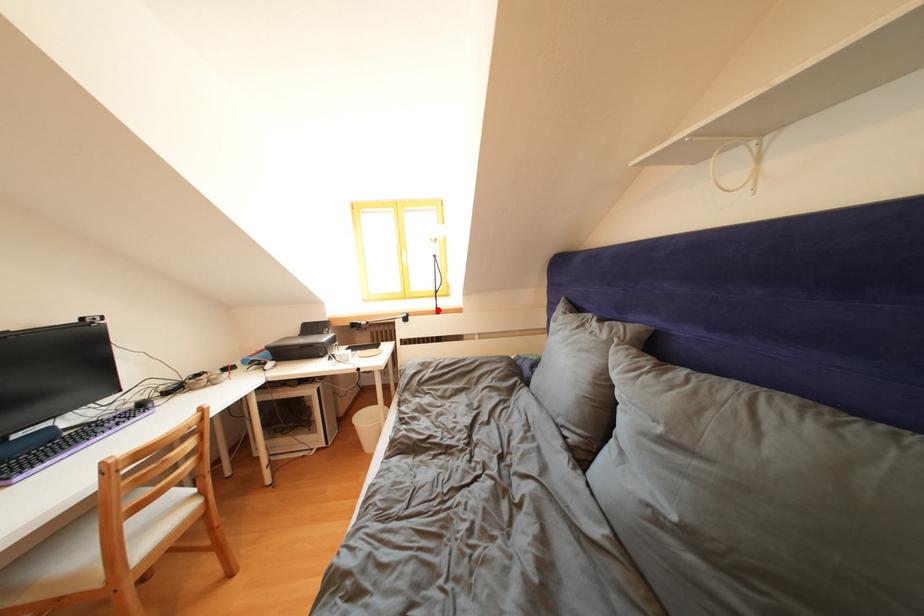
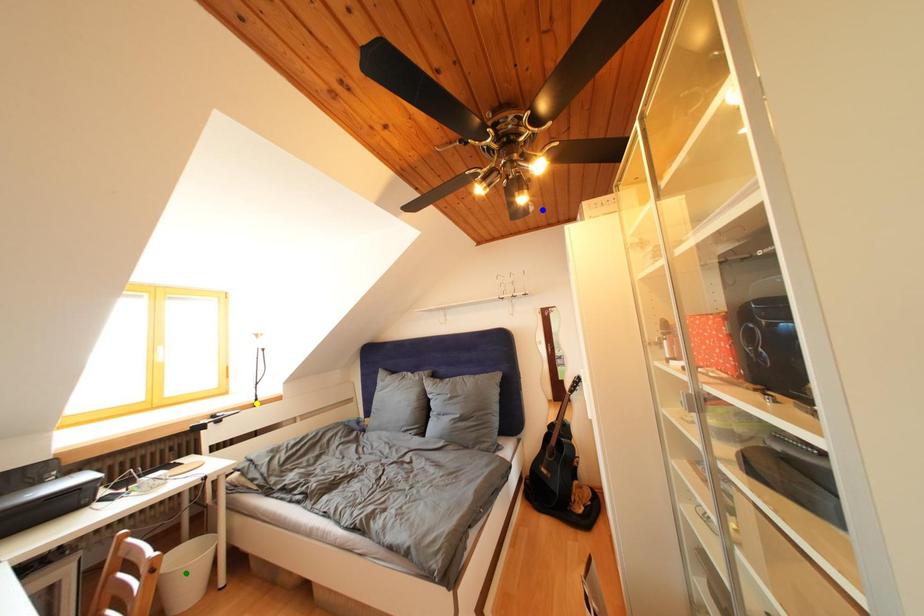
Question: I am providing you with two images of the same scene from different viewpoints. A red point is marked on the first image. You are given multiple points on the second image. Which spot in image 2 lines up with the point in image 1?

Choices:
 (A) blue point
 (B) yellow point
 (C) green point

Answer: (B)